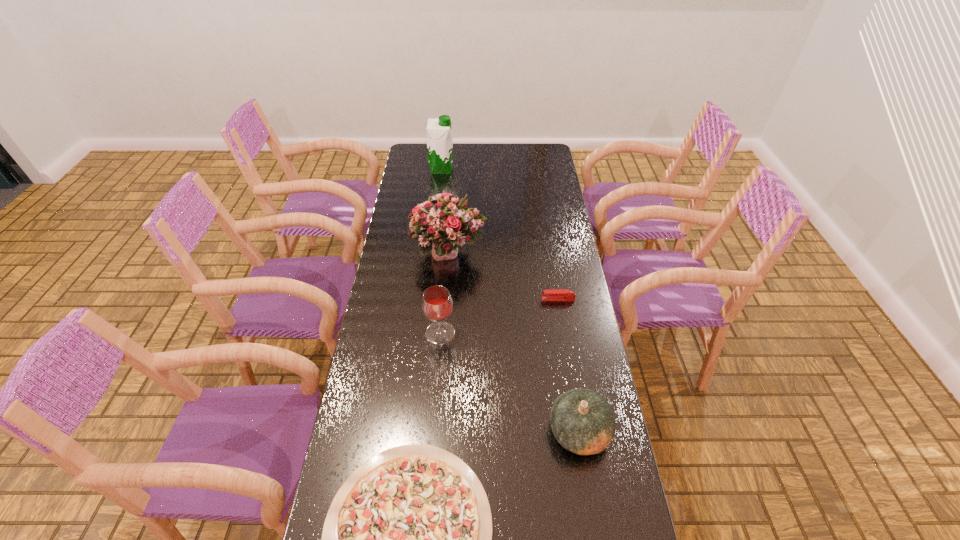
In order to click on vacant space situated 0.170m on the left of the fourth tallest object in this screenshot , I will do `click(486, 431)`.

I want to click on vacant area located 0.340m on the front-facing side of the third farthest object, so click(x=445, y=299).

Find the location of a particular element. This screenshot has height=540, width=960. vacant space located on the front-facing side of the third farthest object is located at coordinates (468, 299).

The width and height of the screenshot is (960, 540). Identify the location of free space located on the front-facing side of the third farthest object. (485, 299).

Locate an element on the screen. This screenshot has width=960, height=540. object that is positioned at the far edge is located at coordinates (439, 138).

In order to click on soya milk that is at the left edge in this screenshot , I will do `click(439, 138)`.

Locate an element on the screen. This screenshot has width=960, height=540. bouquet positioned at the left edge is located at coordinates (442, 223).

Find the location of a particular element. The image size is (960, 540). gourd that is at the right edge is located at coordinates (582, 421).

The width and height of the screenshot is (960, 540). I want to click on stapler at the right edge, so click(x=558, y=294).

The width and height of the screenshot is (960, 540). I want to click on object that is at the far left corner, so click(x=439, y=138).